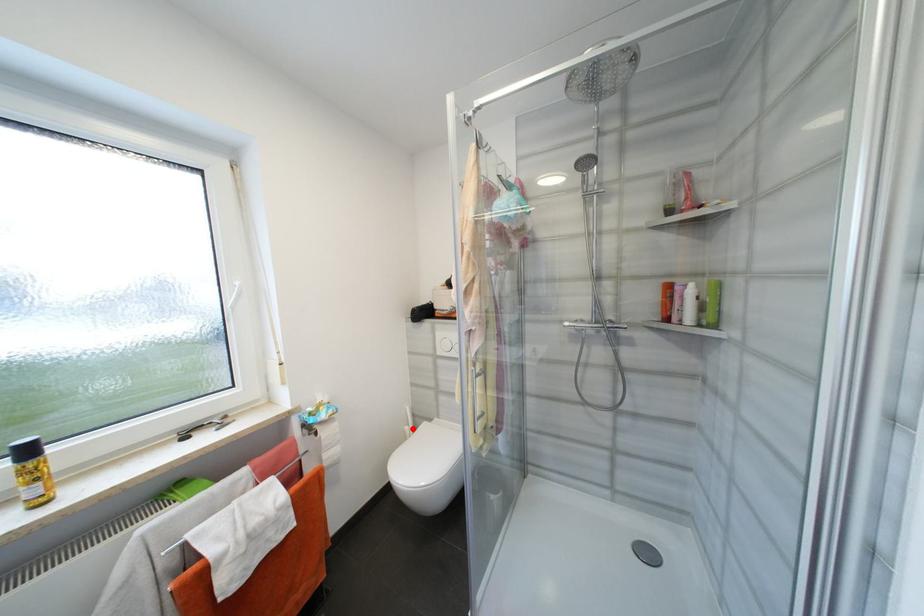
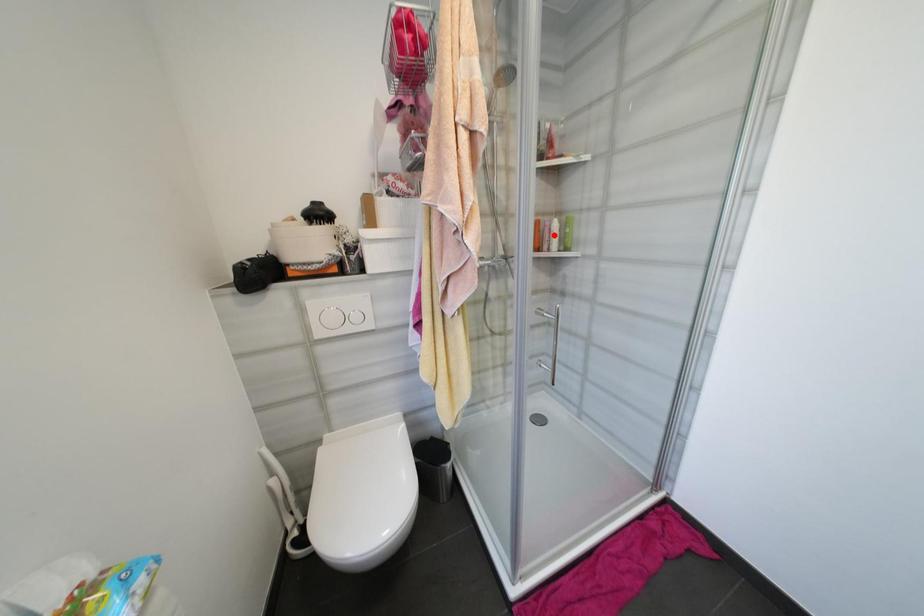
I am providing you with two images of the same scene from different viewpoints. A red point is marked on the first image and another point is marked on the second image. Are the points marked in image1 and image2 representing the same 3D position?

No